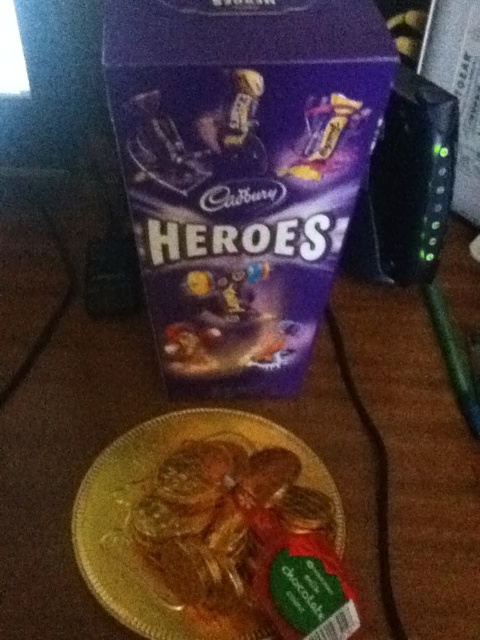
You are setting up a display for a chocolate tasting event. You have a gold foil plate at center and a purple glossy chocolate box at upper center. Which object should you place higher to ensure both are visible from above?

The gold foil plate at center is taller than the purple glossy chocolate box at upper center, so you should place the purple glossy chocolate box at upper center higher to ensure both are visible from above.

You are a chef preparing a dessert platter and need to arrange the gold foil plate at center and the golden textured cookies at center. Given their sizes, which one should you place first to ensure proper arrangement?

The gold foil plate at center is larger in size than the golden textured cookies at center, so you should place the gold foil plate at center first to ensure proper arrangement.